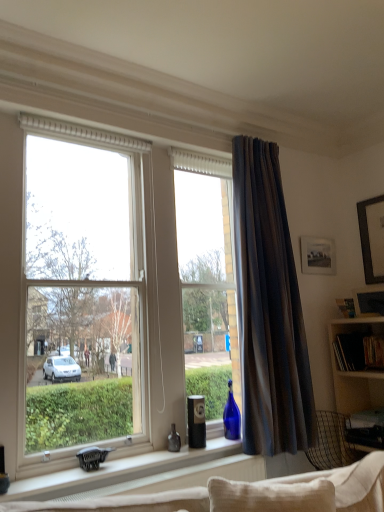
The width and height of the screenshot is (384, 512). In order to click on vacant area to the left of matte glass bottle at window sill in this screenshot , I will do click(x=153, y=454).